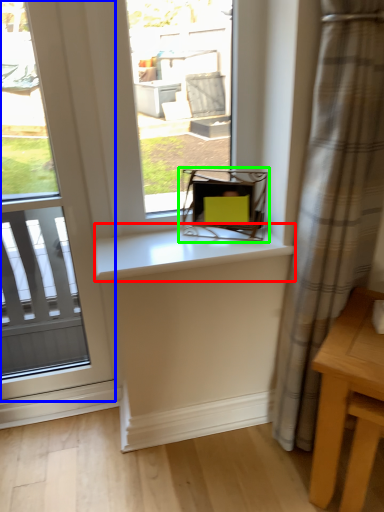
Question: Which object is the closest to the counter top (highlighted by a red box)? Choose among these: window (highlighted by a blue box) or chair (highlighted by a green box).

Choices:
 (A) window
 (B) chair

Answer: (B)